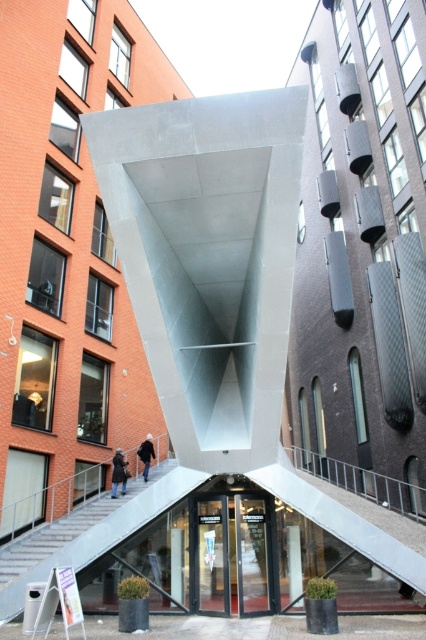
Is metallic gray escalator at lower center taller than black matte jacket at lower left?

In fact, metallic gray escalator at lower center may be shorter than black matte jacket at lower left.

Is metallic gray escalator at lower center in front of black matte jacket at lower left?

Yes, it is in front of black matte jacket at lower left.

Which is in front, point (77, 545) or point (144, 454)?

Point (77, 545)

Find the location of a particular element. This screenshot has height=640, width=426. metallic gray escalator at lower center is located at coordinates (83, 536).

Can you confirm if metallic gray escalator at lower center is positioned below transparent glass door at center?

Yes, metallic gray escalator at lower center is below transparent glass door at center.

This screenshot has width=426, height=640. What are the coordinates of `metallic gray escalator at lower center` in the screenshot? It's located at (83, 536).

Is transparent glass door at center closer to camera compared to black matte jacket at lower left?

Yes, transparent glass door at center is closer to the viewer.

Which is in front, point (256, 609) or point (141, 460)?

Point (256, 609) is in front.

Between point (239, 589) and point (147, 440), which one is positioned behind?

Positioned behind is point (147, 440).

Find the location of a particular element. Image resolution: width=426 pixels, height=640 pixels. transparent glass door at center is located at coordinates (233, 554).